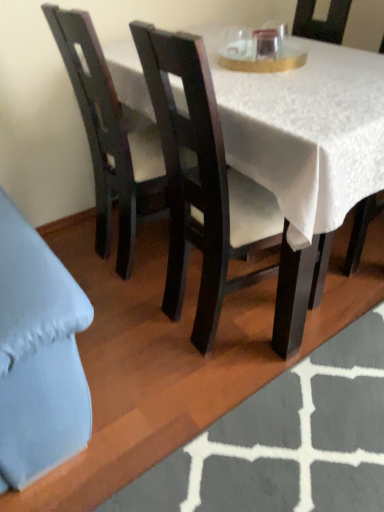
At what (x,y) coordinates should I click in order to perform the action: click on matte black chair at center, which is counted as the first chair, starting from the right. Please return your answer as a coordinate pair (x, y). The image size is (384, 512). Looking at the image, I should click on (321, 21).

In order to face white textured rug at lower center, should I rotate leftwards or rightwards?

To face it directly, rotate right by 16.600 degrees.

Locate an element on the screen. white textured rug at lower center is located at coordinates pos(286,441).

The width and height of the screenshot is (384, 512). Describe the element at coordinates (111, 138) in the screenshot. I see `dark wood chair at left, the first chair viewed from the left` at that location.

What are the coordinates of `dark wood chair at left, the first chair viewed from the left` in the screenshot? It's located at (111, 138).

Find the location of a particular element. This screenshot has height=512, width=384. matte black chair at center, which is counted as the first chair, starting from the right is located at coordinates (321, 21).

Is white textured rug at lower center thinner than dark wood chair at left, which is the third chair in right-to-left order?

No.

From a real-world perspective, does white textured rug at lower center sit lower than dark wood chair at left, which is the third chair in right-to-left order?

Correct, in the physical world, white textured rug at lower center is lower than dark wood chair at left, which is the third chair in right-to-left order.

Image resolution: width=384 pixels, height=512 pixels. In order to click on the 2nd chair above the white textured rug at lower center (from the image's perspective) in this screenshot , I will do `click(111, 138)`.

Considering the sizes of objects white textured rug at lower center and dark wood chair at left, which is the third chair in right-to-left order, in the image provided, who is bigger, white textured rug at lower center or dark wood chair at left, which is the third chair in right-to-left order,?

Bigger between the two is dark wood chair at left, which is the third chair in right-to-left order.

Where is `chair that is behind the matte black chair at center, which is the third chair from left to right`? chair that is behind the matte black chair at center, which is the third chair from left to right is located at coordinates (111, 138).

Is dark wood chair at left, the first chair viewed from the left, with matte black chair at center, which is counted as the first chair, starting from the right?

dark wood chair at left, the first chair viewed from the left, and matte black chair at center, which is counted as the first chair, starting from the right, are clearly separated.

How many degrees apart are the facing directions of dark wood chair at left, the first chair viewed from the left, and matte black chair at center, which is counted as the first chair, starting from the right?

178 degrees separate the facing orientations of dark wood chair at left, the first chair viewed from the left, and matte black chair at center, which is counted as the first chair, starting from the right.

Looking at this image, does dark wood chair at left, which is the third chair in right-to-left order, have a lesser width compared to matte black chair at center, which is the third chair from left to right?

Yes, dark wood chair at left, which is the third chair in right-to-left order, is thinner than matte black chair at center, which is the third chair from left to right.

Is transparent glass at upper center bigger than white textured rug at lower center?

No, transparent glass at upper center is not bigger than white textured rug at lower center.

Between transparent glass at upper center and white textured rug at lower center, which one has larger width?

With larger width is white textured rug at lower center.

Would you say transparent glass at upper center is to the left or to the right of white textured rug at lower center in the picture?

Based on their positions, transparent glass at upper center is located to the left of white textured rug at lower center.

From the image's perspective, relative to white textured rug at lower center, is transparent glass at upper center above or below?

From the image's perspective, transparent glass at upper center appears above white textured rug at lower center.

Considering the relative positions of matte dark wood chair at center, which is the 2th chair in right-to-left order, and white textured rug at lower center in the image provided, is matte dark wood chair at center, which is the 2th chair in right-to-left order, to the left or to the right of white textured rug at lower center?

In the image, matte dark wood chair at center, which is the 2th chair in right-to-left order, appears on the left side of white textured rug at lower center.

From a real-world perspective, is matte dark wood chair at center, which is the 2th chair in right-to-left order, over white textured rug at lower center?

Yes, from a real-world perspective, matte dark wood chair at center, which is the 2th chair in right-to-left order, is above white textured rug at lower center.

From the image's perspective, is matte dark wood chair at center, which is the 2th chair in left-to-right order, above white textured rug at lower center?

Correct, matte dark wood chair at center, which is the 2th chair in left-to-right order, appears higher than white textured rug at lower center in the image.

Is matte dark wood chair at center, which is the 2th chair in left-to-right order, inside the boundaries of white textured rug at lower center, or outside?

matte dark wood chair at center, which is the 2th chair in left-to-right order, exists outside the volume of white textured rug at lower center.

Image resolution: width=384 pixels, height=512 pixels. Find the location of `place mat that appears below the matte dark wood chair at center, which is the 2th chair in left-to-right order (from the image's perspective)`. place mat that appears below the matte dark wood chair at center, which is the 2th chair in left-to-right order (from the image's perspective) is located at coordinates (286, 441).

Which is correct: white textured rug at lower center is inside matte dark wood chair at center, which is the 2th chair in right-to-left order, or outside of it?

white textured rug at lower center is not inside matte dark wood chair at center, which is the 2th chair in right-to-left order, it's outside.

What's the angular difference between white textured rug at lower center and matte dark wood chair at center, which is the 2th chair in right-to-left order,'s facing directions?

white textured rug at lower center and matte dark wood chair at center, which is the 2th chair in right-to-left order, are facing 180 degrees away from each other.

What's the angular difference between transparent glass at upper center and matte black chair at center, which is the third chair from left to right,'s facing directions?

90 degrees.

Does point (253, 42) come closer to viewer compared to point (321, 35)?

Yes, it is.

From the image's perspective, would you say transparent glass at upper center is positioned over matte black chair at center, which is counted as the first chair, starting from the right?

Correct, transparent glass at upper center appears higher than matte black chair at center, which is counted as the first chair, starting from the right, in the image.

Could you tell me if transparent glass at upper center is facing matte black chair at center, which is counted as the first chair, starting from the right?

Yes, transparent glass at upper center is aimed at matte black chair at center, which is counted as the first chair, starting from the right.

From the image's perspective, is matte black chair at center, which is counted as the first chair, starting from the right, over dark wood chair at left, which is the third chair in right-to-left order?

Yes, from the image's perspective, matte black chair at center, which is counted as the first chair, starting from the right, is above dark wood chair at left, which is the third chair in right-to-left order.

Consider the image. Considering the positions of objects matte black chair at center, which is the third chair from left to right, and dark wood chair at left, which is the third chair in right-to-left order, in the image provided, who is behind, matte black chair at center, which is the third chair from left to right, or dark wood chair at left, which is the third chair in right-to-left order,?

dark wood chair at left, which is the third chair in right-to-left order, is more distant.

Is point (364, 202) positioned in front of point (98, 142)?

No, (364, 202) is further to viewer.

Where is `the 2nd chair to the left when counting from the white textured rug at lower center`? Image resolution: width=384 pixels, height=512 pixels. the 2nd chair to the left when counting from the white textured rug at lower center is located at coordinates (111, 138).

Locate an element on the screen. the 2nd chair counting from the right side of the dark wood chair at left, which is the third chair in right-to-left order is located at coordinates (321, 21).

Estimate the real-world distances between objects in this image. Which object is closer to matte dark wood chair at center, which is the 2th chair in left-to-right order, matte black chair at center, which is counted as the first chair, starting from the right, or dark wood chair at left, which is the third chair in right-to-left order?

dark wood chair at left, which is the third chair in right-to-left order.

Based on the photo, considering their positions, is white textured rug at lower center positioned further to matte black chair at center, which is the third chair from left to right, than matte dark wood chair at center, which is the 2th chair in right-to-left order?

Among the two, white textured rug at lower center is located further to matte black chair at center, which is the third chair from left to right.

Based on their spatial positions, is matte black chair at center, which is the third chair from left to right, or white textured rug at lower center further from transparent glass at upper center?

Among the two, white textured rug at lower center is located further to transparent glass at upper center.

Based on their spatial positions, is white textured rug at lower center or transparent glass at upper center closer to dark wood chair at left, which is the third chair in right-to-left order?

transparent glass at upper center.

Considering their positions, is matte dark wood chair at center, which is the 2th chair in right-to-left order, positioned closer to matte black chair at center, which is counted as the first chair, starting from the right, than white textured rug at lower center?

matte dark wood chair at center, which is the 2th chair in right-to-left order, lies closer to matte black chair at center, which is counted as the first chair, starting from the right, than the other object.

When comparing their distances from white textured rug at lower center, does matte black chair at center, which is counted as the first chair, starting from the right, or transparent glass at upper center seem further?

matte black chair at center, which is counted as the first chair, starting from the right.

Looking at the image, which one is located closer to matte dark wood chair at center, which is the 2th chair in right-to-left order, transparent glass at upper center or dark wood chair at left, which is the third chair in right-to-left order?

dark wood chair at left, which is the third chair in right-to-left order, lies closer to matte dark wood chair at center, which is the 2th chair in right-to-left order, than the other object.

Consider the image. Estimate the real-world distances between objects in this image. Which object is further from matte black chair at center, which is the third chair from left to right, dark wood chair at left, the first chair viewed from the left, or transparent glass at upper center?

dark wood chair at left, the first chair viewed from the left, is further to matte black chair at center, which is the third chair from left to right.

You are a GUI agent. You are given a task and a screenshot of the screen. Output one action in this format:
    pyautogui.click(x=<x>, y=<y>)
    Task: Click on the chair between dark wood chair at left, which is the third chair in right-to-left order, and matte black chair at center, which is the third chair from left to right
    This screenshot has width=384, height=512.
    Given the screenshot: What is the action you would take?
    pyautogui.click(x=213, y=197)

Find the location of a particular element. This screenshot has height=512, width=384. coffee cup between dark wood chair at left, which is the third chair in right-to-left order, and matte black chair at center, which is the third chair from left to right, in the horizontal direction is located at coordinates (265, 44).

You are a GUI agent. You are given a task and a screenshot of the screen. Output one action in this format:
    pyautogui.click(x=<x>, y=<y>)
    Task: Click on the chair between dark wood chair at left, which is the third chair in right-to-left order, and white textured rug at lower center in the up-down direction
    
    Given the screenshot: What is the action you would take?
    pyautogui.click(x=213, y=197)